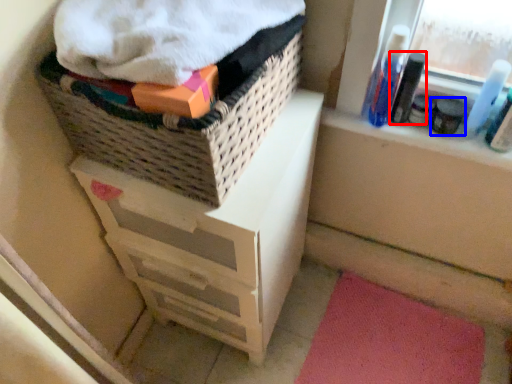
Question: Among these objects, which one is farthest to the camera, mouthwash (highlighted by a red box) or toiletry (highlighted by a blue box)?

Choices:
 (A) mouthwash
 (B) toiletry

Answer: (B)